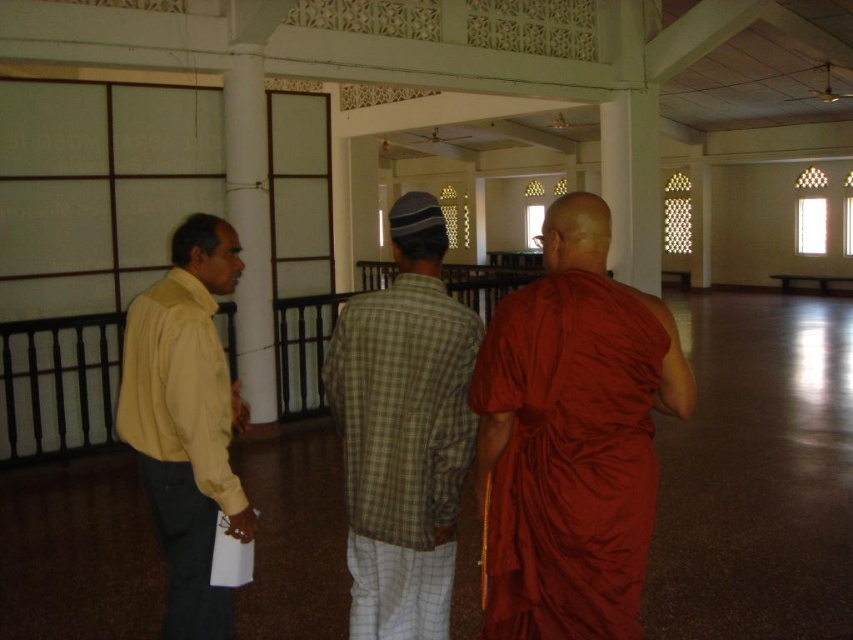
Can you confirm if matte orange robe at right is smaller than green plaid shirt at center?

Yes.

Is matte orange robe at right bigger than green plaid shirt at center?

No, matte orange robe at right is not bigger than green plaid shirt at center.

Who is more distant from viewer, (541,560) or (384,496)?

The point (384,496) is more distant.

Locate an element on the screen. This screenshot has height=640, width=853. matte orange robe at right is located at coordinates pos(569,458).

Is point (398, 332) farther from camera compared to point (148, 349)?

No.

Who is shorter, green plaid shirt at center or yellow matte shirt at left?

With less height is green plaid shirt at center.

What do you see at coordinates (403, 432) in the screenshot? The image size is (853, 640). I see `green plaid shirt at center` at bounding box center [403, 432].

This screenshot has height=640, width=853. Find the location of `green plaid shirt at center`. green plaid shirt at center is located at coordinates click(403, 432).

Between matte orange robe at right and yellow matte shirt at left, which one is positioned higher?

matte orange robe at right is above.

Does matte orange robe at right appear on the left side of yellow matte shirt at left?

In fact, matte orange robe at right is to the right of yellow matte shirt at left.

Image resolution: width=853 pixels, height=640 pixels. Find the location of `matte orange robe at right`. matte orange robe at right is located at coordinates (569, 458).

This screenshot has width=853, height=640. Find the location of `matte orange robe at right`. matte orange robe at right is located at coordinates (569, 458).